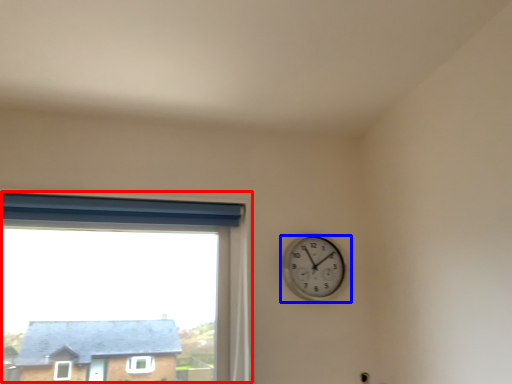
Question: Which of the following is the farthest to the observer, window (highlighted by a red box) or wall clock (highlighted by a blue box)?

Choices:
 (A) window
 (B) wall clock

Answer: (B)